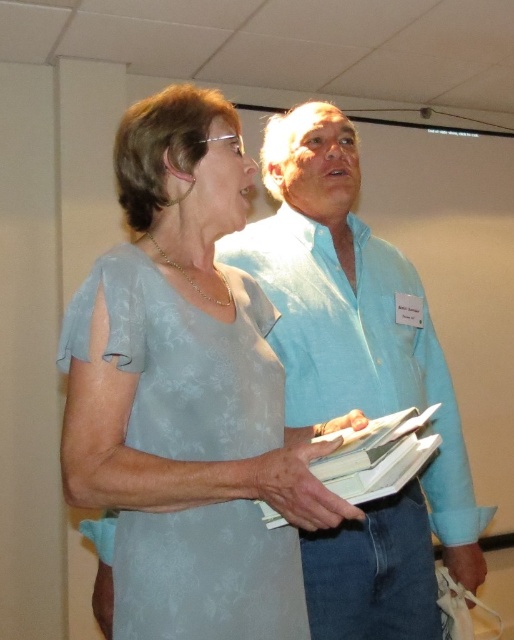
Question: Does light blue shirt at center have a larger size compared to matte blue dress at center?

Choices:
 (A) yes
 (B) no

Answer: (A)

Question: Among these points, which one is nearest to the camera?

Choices:
 (A) (350, 236)
 (B) (160, 173)

Answer: (B)

Question: Which point appears closest to the camera in this image?

Choices:
 (A) (126, 308)
 (B) (354, 147)

Answer: (A)

Question: Does light blue shirt at center have a larger size compared to matte blue dress at center?

Choices:
 (A) yes
 (B) no

Answer: (A)

Question: In this image, where is light blue shirt at center located relative to matte blue dress at center?

Choices:
 (A) above
 (B) below

Answer: (B)